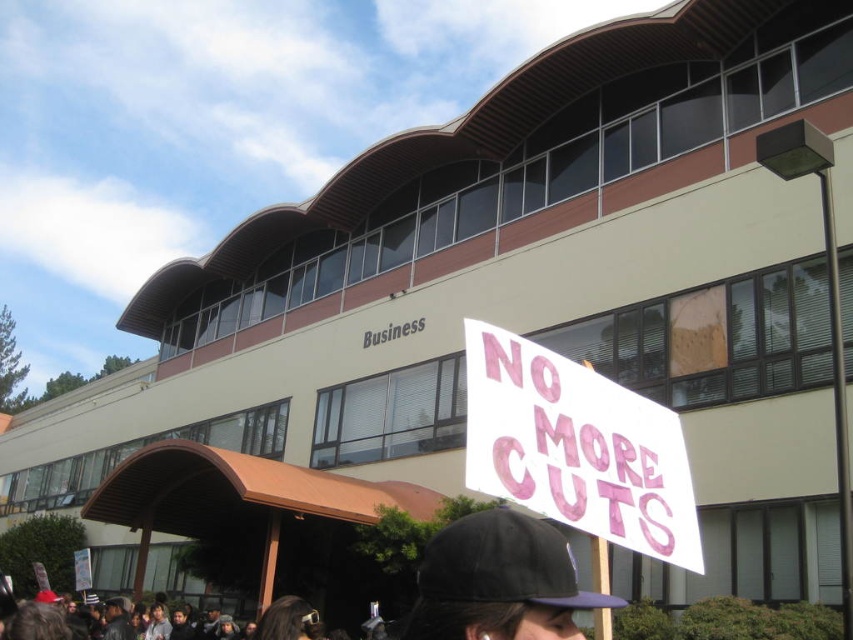
Looking at this image, you are a photographer trying to capture a clear shot of the protest sign and the person holding it. Given that the white paper sign at center is taller than the black fabric baseball cap at center, will the sign be mostly visible above the cap in your photo?

Yes, the white paper sign at center is taller than the black fabric baseball cap at center, so the sign will be mostly visible above the cap in the photo.

Based on the scene description, what object is located at the coordinates point (576,448)?

The point (576,448) corresponds to the white paper sign at center.

Based on the scene description, where is the white paper sign at center located in terms of coordinates?

The white paper sign at center is located at coordinates point (576,448).